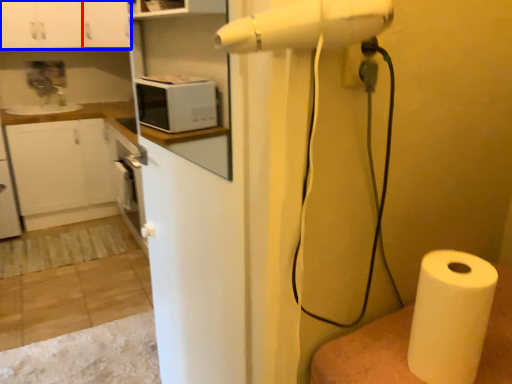
Question: Which object appears closest to the camera in this image, cabinetry (highlighted by a red box) or cabinetry (highlighted by a blue box)?

Choices:
 (A) cabinetry
 (B) cabinetry

Answer: (B)